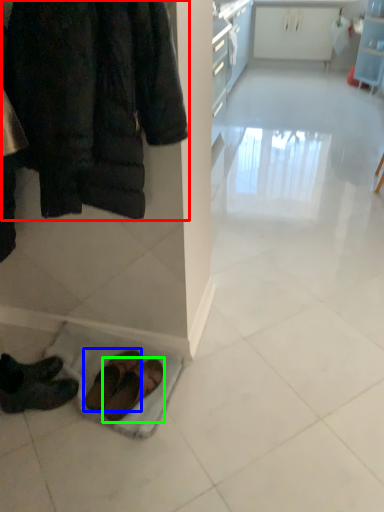
Question: Based on their relative distances, which object is farther from jacket (highlighted by a red box)? Choose from footwear (highlighted by a blue box) and footwear (highlighted by a green box).

Choices:
 (A) footwear
 (B) footwear

Answer: (B)